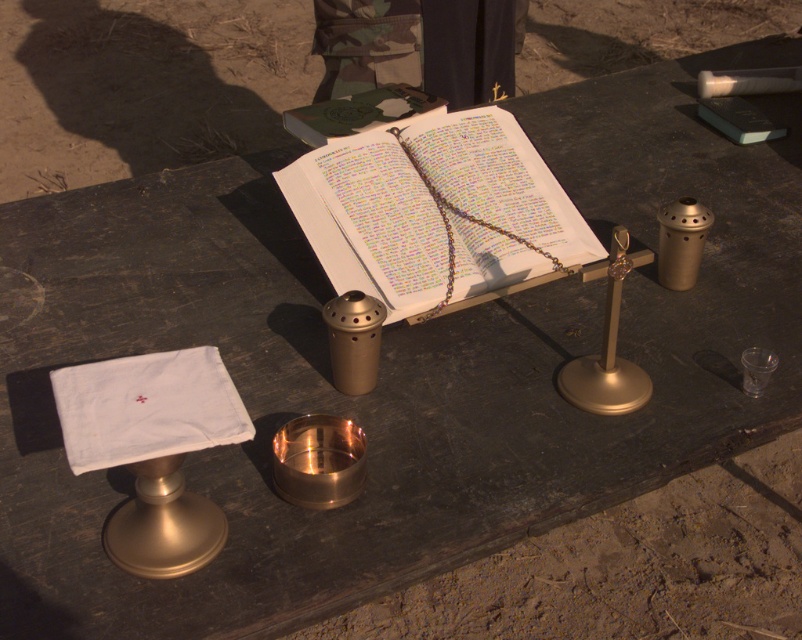
You are a participant in a ceremony and need to place a small offering on the table. The white cloth at left is currently at point (148, 406). Where should you place the offering if you want it to be closer to the open book at center than to the white cloth at left?

Place the offering closer to the open book at center than to the white cloth at left by positioning it along the line connecting both points, but closer to the book.